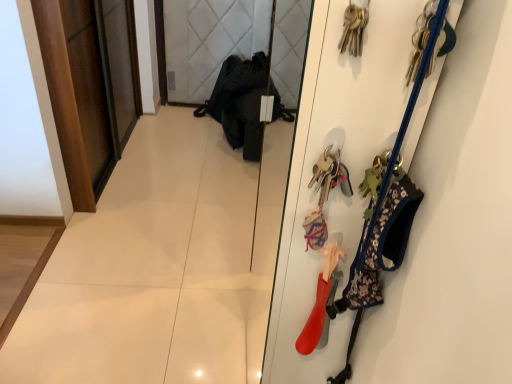
Question: Is dark wood door at left oriented away from rubberized red boot at right, the first accessory positioned from the bottom?

Choices:
 (A) yes
 (B) no

Answer: (B)

Question: Is dark wood door at left far away from rubberized red boot at right, the first accessory positioned from the bottom?

Choices:
 (A) yes
 (B) no

Answer: (A)

Question: Is dark wood door at left at the left side of rubberized red boot at right, the 3th accessory positioned from the top?

Choices:
 (A) yes
 (B) no

Answer: (A)

Question: Considering the relative positions of dark wood door at left and rubberized red boot at right, the first accessory positioned from the bottom, in the image provided, is dark wood door at left behind rubberized red boot at right, the first accessory positioned from the bottom,?

Choices:
 (A) no
 (B) yes

Answer: (B)

Question: Does dark wood door at left appear on the right side of rubberized red boot at right, the first accessory positioned from the bottom?

Choices:
 (A) yes
 (B) no

Answer: (B)

Question: In the image, is dark wood door at left positioned in front of or behind rubberized red boot at right, the 3th accessory positioned from the top?

Choices:
 (A) behind
 (B) front

Answer: (A)

Question: Considering the positions of dark wood door at left and rubberized red boot at right, the 3th accessory positioned from the top, in the image, is dark wood door at left wider or thinner than rubberized red boot at right, the 3th accessory positioned from the top,?

Choices:
 (A) wide
 (B) thin

Answer: (A)

Question: In terms of size, does dark wood door at left appear bigger or smaller than rubberized red boot at right, the first accessory positioned from the bottom?

Choices:
 (A) big
 (B) small

Answer: (A)

Question: Based on their positions, is dark wood door at left located to the left or right of rubberized red boot at right, the 3th accessory positioned from the top?

Choices:
 (A) right
 (B) left

Answer: (B)

Question: From a real-world perspective, relative to dark wood door at left, is rubberized red boot at right, the first accessory positioned from the bottom, vertically above or below?

Choices:
 (A) above
 (B) below

Answer: (A)

Question: From the image's perspective, relative to dark wood door at left, is rubberized red boot at right, the 3th accessory positioned from the top, above or below?

Choices:
 (A) above
 (B) below

Answer: (B)

Question: Considering the relative positions of rubberized red boot at right, the first accessory positioned from the bottom, and dark wood door at left in the image provided, is rubberized red boot at right, the first accessory positioned from the bottom, to the left or to the right of dark wood door at left?

Choices:
 (A) left
 (B) right

Answer: (B)

Question: In terms of height, does rubberized red boot at right, the first accessory positioned from the bottom, look taller or shorter compared to dark wood door at left?

Choices:
 (A) tall
 (B) short

Answer: (B)

Question: From the image's perspective, is clear glass mirror at center above or below rubberized red boot at right, the first accessory positioned from the bottom?

Choices:
 (A) below
 (B) above

Answer: (B)

Question: Considering the positions of clear glass mirror at center and rubberized red boot at right, the 3th accessory positioned from the top, in the image, is clear glass mirror at center wider or thinner than rubberized red boot at right, the 3th accessory positioned from the top,?

Choices:
 (A) thin
 (B) wide

Answer: (A)